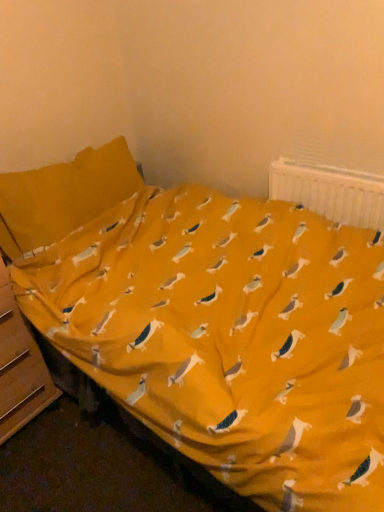
Question: Considering the relative positions of wooden file cabinet at lower left and white plastic radiator at upper right in the image provided, is wooden file cabinet at lower left to the right of white plastic radiator at upper right from the viewer's perspective?

Choices:
 (A) no
 (B) yes

Answer: (A)

Question: Is wooden file cabinet at lower left surrounding white plastic radiator at upper right?

Choices:
 (A) yes
 (B) no

Answer: (B)

Question: Is wooden file cabinet at lower left positioned with its back to white plastic radiator at upper right?

Choices:
 (A) no
 (B) yes

Answer: (A)

Question: Is wooden file cabinet at lower left thinner than white plastic radiator at upper right?

Choices:
 (A) yes
 (B) no

Answer: (B)

Question: Could you tell me if wooden file cabinet at lower left is turned towards white plastic radiator at upper right?

Choices:
 (A) yes
 (B) no

Answer: (B)

Question: From a real-world perspective, is wooden file cabinet at lower left beneath white plastic radiator at upper right?

Choices:
 (A) yes
 (B) no

Answer: (A)

Question: Is white plastic radiator at upper right far from wooden file cabinet at lower left?

Choices:
 (A) no
 (B) yes

Answer: (B)

Question: Is white plastic radiator at upper right smaller than wooden file cabinet at lower left?

Choices:
 (A) yes
 (B) no

Answer: (A)

Question: Can wooden file cabinet at lower left be found inside white plastic radiator at upper right?

Choices:
 (A) no
 (B) yes

Answer: (A)

Question: Does white plastic radiator at upper right appear on the right side of wooden file cabinet at lower left?

Choices:
 (A) no
 (B) yes

Answer: (B)

Question: From the image's perspective, would you say white plastic radiator at upper right is positioned over wooden file cabinet at lower left?

Choices:
 (A) no
 (B) yes

Answer: (B)

Question: Is the position of white plastic radiator at upper right more distant than that of wooden file cabinet at lower left?

Choices:
 (A) no
 (B) yes

Answer: (B)

Question: Is white plastic radiator at upper right taller or shorter than wooden file cabinet at lower left?

Choices:
 (A) tall
 (B) short

Answer: (B)